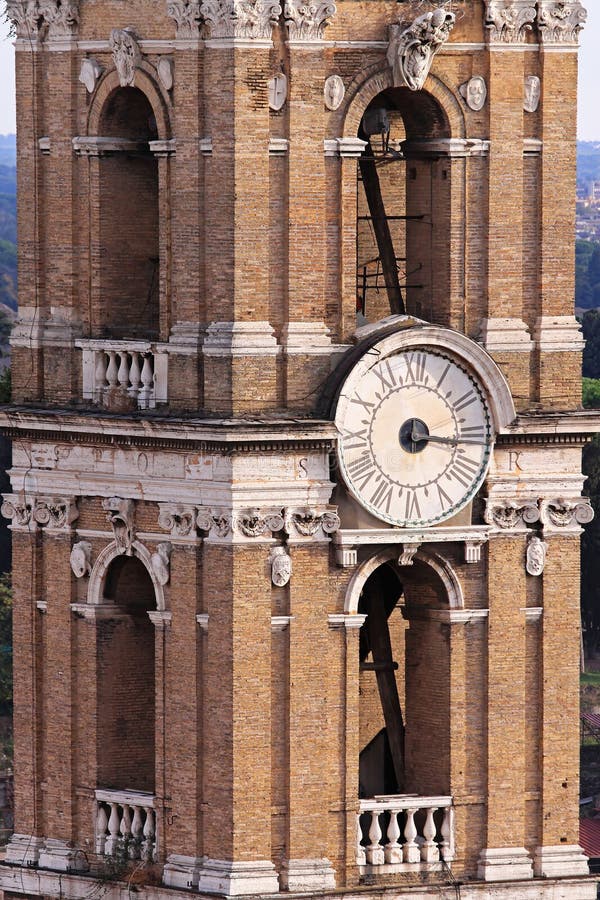
Identify the location of wooden support beam. (386, 681).